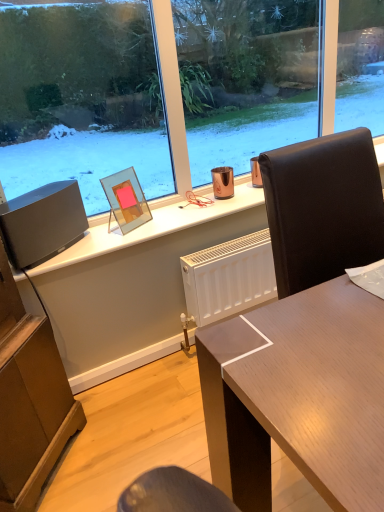
Question: Is matte black speaker at left further to the viewer compared to transparent glass picture frame at upper center?

Choices:
 (A) yes
 (B) no

Answer: (B)

Question: Can you confirm if matte black speaker at left is wider than transparent glass picture frame at upper center?

Choices:
 (A) yes
 (B) no

Answer: (A)

Question: Considering the relative sizes of matte black speaker at left and transparent glass picture frame at upper center in the image provided, is matte black speaker at left thinner than transparent glass picture frame at upper center?

Choices:
 (A) no
 (B) yes

Answer: (A)

Question: Is matte black speaker at left with transparent glass picture frame at upper center?

Choices:
 (A) no
 (B) yes

Answer: (A)

Question: Is there a large distance between matte black speaker at left and transparent glass picture frame at upper center?

Choices:
 (A) yes
 (B) no

Answer: (B)

Question: From the image's perspective, is matte black speaker at left under transparent glass picture frame at upper center?

Choices:
 (A) no
 (B) yes

Answer: (B)

Question: Would you consider transparent glass picture frame at upper center to be distant from matte black speaker at left?

Choices:
 (A) no
 (B) yes

Answer: (A)

Question: Does transparent glass picture frame at upper center have a larger size compared to matte black speaker at left?

Choices:
 (A) no
 (B) yes

Answer: (A)

Question: Can you confirm if transparent glass picture frame at upper center is smaller than matte black speaker at left?

Choices:
 (A) yes
 (B) no

Answer: (A)

Question: Is transparent glass picture frame at upper center turned away from matte black speaker at left?

Choices:
 (A) no
 (B) yes

Answer: (A)

Question: Considering the relative sizes of transparent glass picture frame at upper center and matte black speaker at left in the image provided, is transparent glass picture frame at upper center taller than matte black speaker at left?

Choices:
 (A) no
 (B) yes

Answer: (B)

Question: Can you confirm if transparent glass picture frame at upper center is thinner than matte black speaker at left?

Choices:
 (A) no
 (B) yes

Answer: (B)

Question: Considering the positions of matte black speaker at left and transparent glass picture frame at upper center in the image, is matte black speaker at left bigger or smaller than transparent glass picture frame at upper center?

Choices:
 (A) big
 (B) small

Answer: (A)